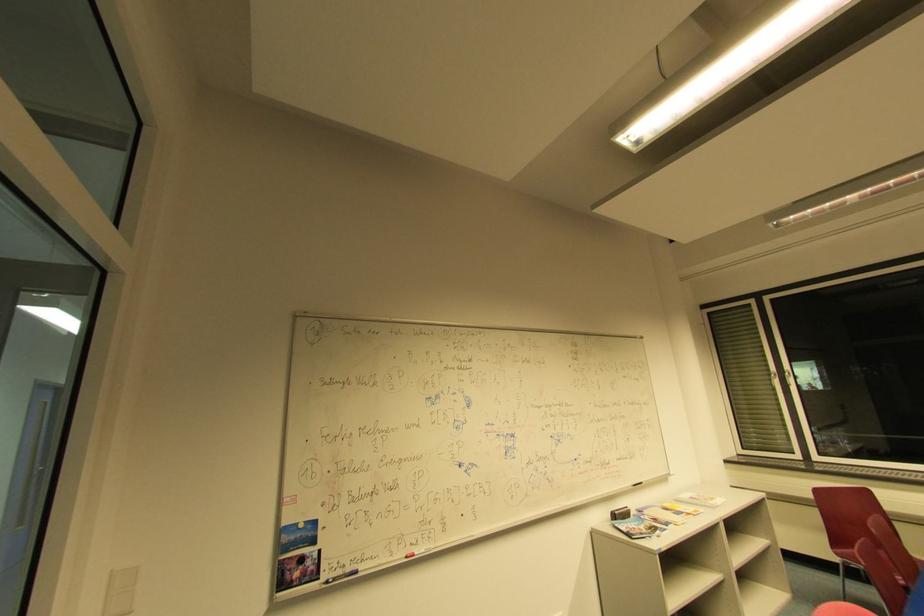
The image size is (924, 616). Find the location of `red chair sitting surface`. red chair sitting surface is located at coordinates (856, 544).